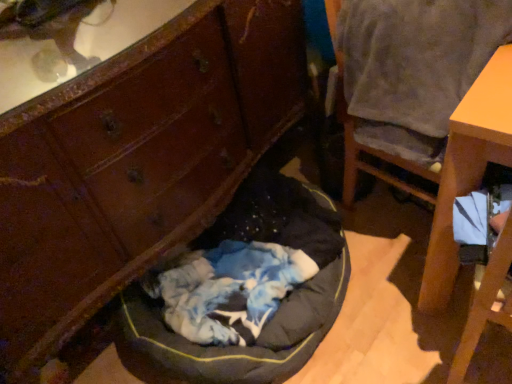
Find the location of a particular element. Image resolution: width=512 pixels, height=384 pixels. dark gray fabric dog bed at center is located at coordinates (245, 291).

In terms of size, does dark gray fabric dog bed at center appear bigger or smaller than gray fabric chair at upper right?

Clearly, dark gray fabric dog bed at center is larger in size than gray fabric chair at upper right.

Which is more to the left, dark gray fabric dog bed at center or gray fabric chair at upper right?

dark gray fabric dog bed at center.

Are dark gray fabric dog bed at center and gray fabric chair at upper right far apart?

No.

Consider the image. Is dark gray fabric dog bed at center wider or thinner than gray fabric chair at upper right?

dark gray fabric dog bed at center is wider than gray fabric chair at upper right.

Considering the sizes of objects gray fabric chair at upper right and dark gray fabric dog bed at center in the image provided, who is wider, gray fabric chair at upper right or dark gray fabric dog bed at center?

dark gray fabric dog bed at center.

Can dark gray fabric dog bed at center be found inside gray fabric chair at upper right?

No, gray fabric chair at upper right does not contain dark gray fabric dog bed at center.

Are gray fabric chair at upper right and dark gray fabric dog bed at center making contact?

There is a gap between gray fabric chair at upper right and dark gray fabric dog bed at center.

Find the location of a particular element. The image size is (512, 384). cabinetry that appears in front of the gray fabric chair at upper right is located at coordinates (135, 162).

Can you confirm if wooden dresser at lower left is taller than gray fabric chair at upper right?

Yes.

From the image's perspective, between wooden dresser at lower left and gray fabric chair at upper right, which one is located above?

From the image's view, gray fabric chair at upper right is above.

Based on the photo, can you confirm if wooden dresser at lower left is thinner than gray fabric chair at upper right?

No.

From the image's perspective, is gray fabric chair at upper right above or below wooden dresser at lower left?

From the image's perspective, gray fabric chair at upper right appears above wooden dresser at lower left.

Is gray fabric chair at upper right to the right of wooden dresser at lower left from the viewer's perspective?

Yes, gray fabric chair at upper right is to the right of wooden dresser at lower left.

In the image, is gray fabric chair at upper right positioned in front of or behind wooden dresser at lower left?

Clearly, gray fabric chair at upper right is behind wooden dresser at lower left.

Which of these two, gray fabric chair at upper right or wooden dresser at lower left, is thinner?

With smaller width is gray fabric chair at upper right.

Would you say wooden dresser at lower left is outside dark gray fabric dog bed at center?

Yes, wooden dresser at lower left is outside of dark gray fabric dog bed at center.

The width and height of the screenshot is (512, 384). Identify the location of dog bed that is on the right side of wooden dresser at lower left. (245, 291).

How different are the orientations of wooden dresser at lower left and dark gray fabric dog bed at center in degrees?

6.01 degrees separate the facing orientations of wooden dresser at lower left and dark gray fabric dog bed at center.

Considering the relative sizes of wooden dresser at lower left and dark gray fabric dog bed at center in the image provided, is wooden dresser at lower left taller than dark gray fabric dog bed at center?

Yes, wooden dresser at lower left is taller than dark gray fabric dog bed at center.

Between dark gray fabric dog bed at center and wooden dresser at lower left, which one is positioned in front?

Positioned in front is wooden dresser at lower left.

Which object is positioned more to the left, dark gray fabric dog bed at center or wooden dresser at lower left?

wooden dresser at lower left is more to the left.

Can you confirm if dark gray fabric dog bed at center is smaller than wooden dresser at lower left?

Yes.

Consider the image. Could you tell me if dark gray fabric dog bed at center is turned towards wooden dresser at lower left?

No, dark gray fabric dog bed at center is not facing towards wooden dresser at lower left.

This screenshot has width=512, height=384. I want to click on dog bed behind the gray fabric chair at upper right, so click(x=245, y=291).

Where is `chair that appears above the dark gray fabric dog bed at center (from the image's perspective)`? This screenshot has width=512, height=384. chair that appears above the dark gray fabric dog bed at center (from the image's perspective) is located at coordinates (409, 77).

From the image, which object appears to be farther from dark gray fabric dog bed at center, gray fabric chair at upper right or wooden dresser at lower left?

gray fabric chair at upper right is further to dark gray fabric dog bed at center.

When comparing their distances from wooden dresser at lower left, does gray fabric chair at upper right or dark gray fabric dog bed at center seem closer?

dark gray fabric dog bed at center is closer to wooden dresser at lower left.

When comparing their distances from dark gray fabric dog bed at center, does wooden dresser at lower left or gray fabric chair at upper right seem closer?

wooden dresser at lower left is closer to dark gray fabric dog bed at center.

Based on their spatial positions, is dark gray fabric dog bed at center or wooden dresser at lower left further from gray fabric chair at upper right?

Among the two, dark gray fabric dog bed at center is located further to gray fabric chair at upper right.

In the scene shown: Based on their spatial positions, is wooden dresser at lower left or dark gray fabric dog bed at center closer to gray fabric chair at upper right?

wooden dresser at lower left is positioned closer to the anchor gray fabric chair at upper right.

Looking at the image, which one is located further to wooden dresser at lower left, dark gray fabric dog bed at center or gray fabric chair at upper right?

gray fabric chair at upper right.

You are a GUI agent. You are given a task and a screenshot of the screen. Output one action in this format:
    pyautogui.click(x=<x>, y=<y>)
    Task: Click on the dog bed between wooden dresser at lower left and gray fabric chair at upper right in the horizontal direction
    
    Given the screenshot: What is the action you would take?
    pyautogui.click(x=245, y=291)